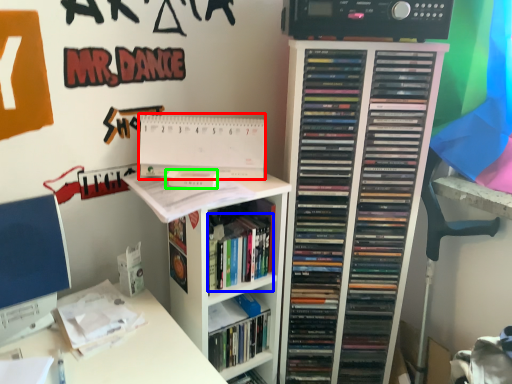
Question: Based on their relative distances, which object is farther from paperback book (highlighted by a red box)? Choose from book (highlighted by a blue box) and paperback book (highlighted by a green box).

Choices:
 (A) book
 (B) paperback book

Answer: (A)